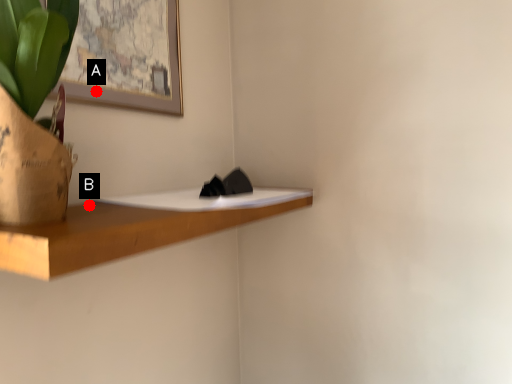
Question: Two points are circled on the image, labeled by A and B beside each circle. Among these points, which one is farthest from the camera?

Choices:
 (A) A is further
 (B) B is further

Answer: (A)